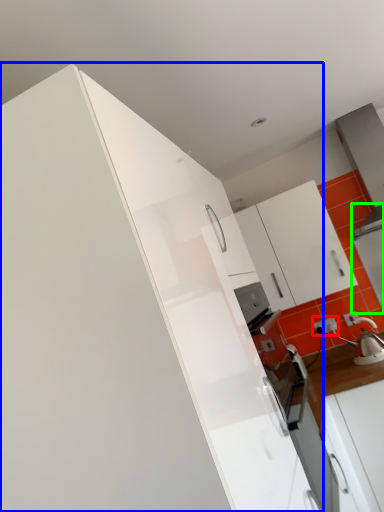
Question: Which object is positioned farthest from electric outlet (highlighted by a red box)? Select from cabinetry (highlighted by a blue box) and appliance (highlighted by a green box).

Choices:
 (A) cabinetry
 (B) appliance

Answer: (A)